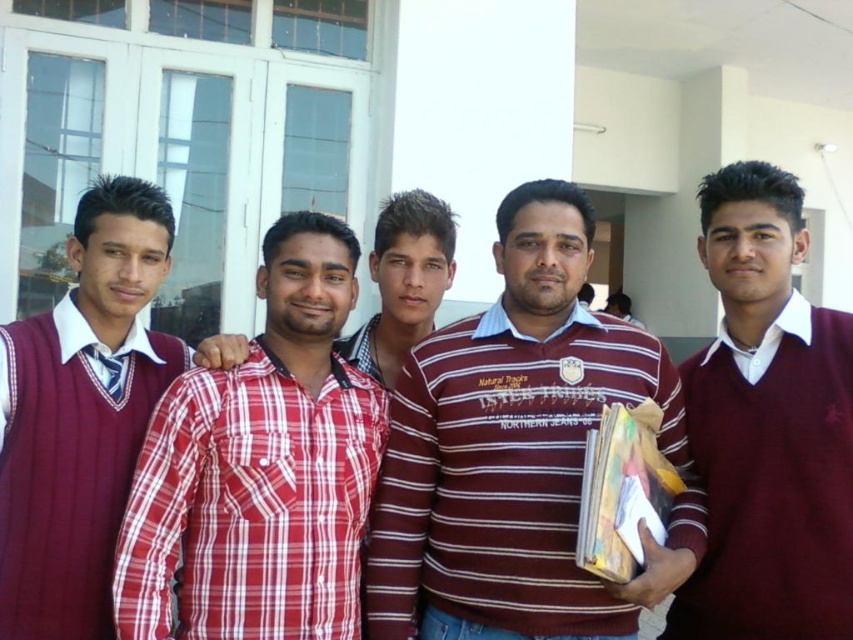
Can you confirm if maroon striped shirt at center is positioned to the left of maroon ribbed sweater at left?

No, maroon striped shirt at center is not to the left of maroon ribbed sweater at left.

Does maroon striped shirt at center appear under maroon ribbed sweater at left?

Correct, maroon striped shirt at center is located below maroon ribbed sweater at left.

Who is more forward, [519,404] or [21,518]?

Positioned in front is point [21,518].

Find the location of `maroon striped shirt at center`. maroon striped shirt at center is located at coordinates (518, 452).

Is maroon sweater at right to the left of maroon ribbed sweater at left from the viewer's perspective?

Incorrect, maroon sweater at right is not on the left side of maroon ribbed sweater at left.

The image size is (853, 640). I want to click on maroon sweater at right, so click(767, 428).

The width and height of the screenshot is (853, 640). I want to click on maroon sweater at right, so click(x=767, y=428).

Is red plaid shirt at center smaller than plaid cotton shirt at center?

No, red plaid shirt at center is not smaller than plaid cotton shirt at center.

Between red plaid shirt at center and plaid cotton shirt at center, which one has less height?

plaid cotton shirt at center is shorter.

Between point (312, 337) and point (424, 257), which one is positioned behind?

Point (424, 257)

Locate an element on the screen. red plaid shirt at center is located at coordinates (260, 467).